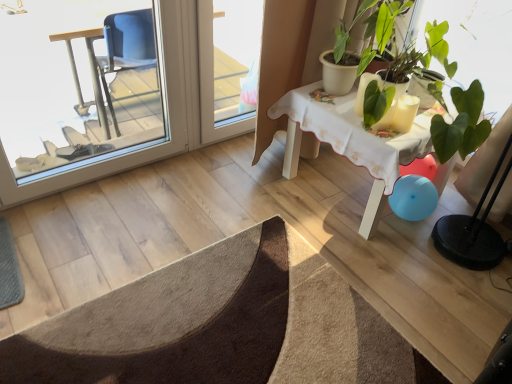
Locate an element on the screen. The height and width of the screenshot is (384, 512). vacant area situated to the left side of white glossy candle at upper right is located at coordinates (354, 116).